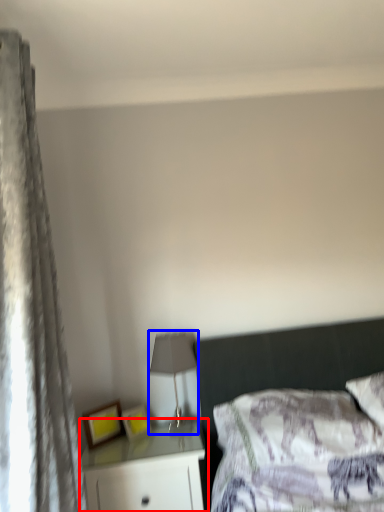
Question: Which of the following is the farthest to the observer, nightstand (highlighted by a red box) or lamp (highlighted by a blue box)?

Choices:
 (A) nightstand
 (B) lamp

Answer: (B)